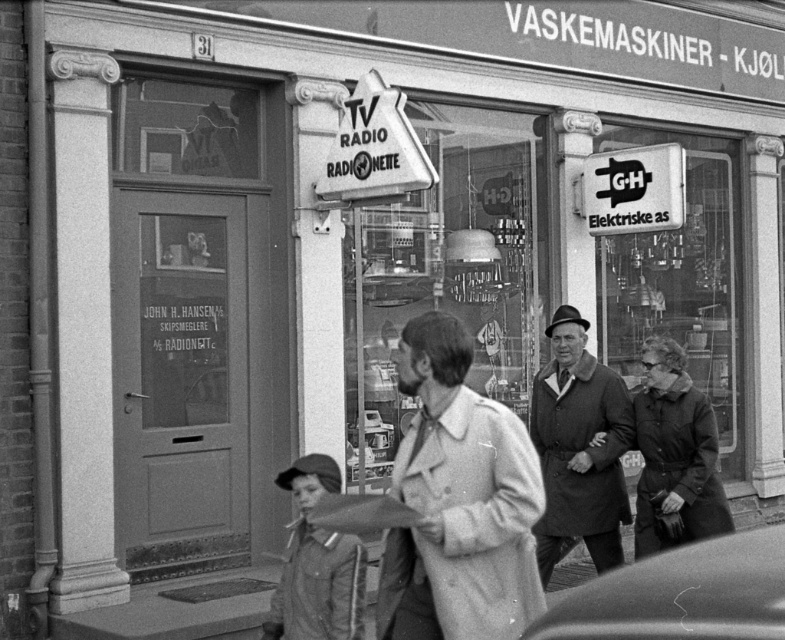
Is point (740, 634) positioned before point (391, 508)?

Yes, it is.

Does metallic car at lower right have a smaller size compared to matte black umbrella at center?

No, metallic car at lower right is not smaller than matte black umbrella at center.

The height and width of the screenshot is (640, 785). What are the coordinates of `metallic car at lower right` in the screenshot? It's located at (681, 595).

Identify the location of metallic car at lower right. (681, 595).

What do you see at coordinates (444, 272) in the screenshot? I see `metallic glass display at center` at bounding box center [444, 272].

Is point (519, 353) closer to camera compared to point (382, 506)?

No, it is behind (382, 506).

The image size is (785, 640). I want to click on metallic glass display at center, so click(444, 272).

Locate an element on the screen. The image size is (785, 640). metallic glass display at center is located at coordinates (444, 272).

Is point (717, 499) farther from viewer compared to point (280, 612)?

Yes, it is.

Who is taller, dark brown leather coat at center or denim jacket at lower center?

With more height is dark brown leather coat at center.

Where is `dark brown leather coat at center`? Image resolution: width=785 pixels, height=640 pixels. dark brown leather coat at center is located at coordinates (674, 456).

Identify the location of dark brown leather coat at center. (674, 456).